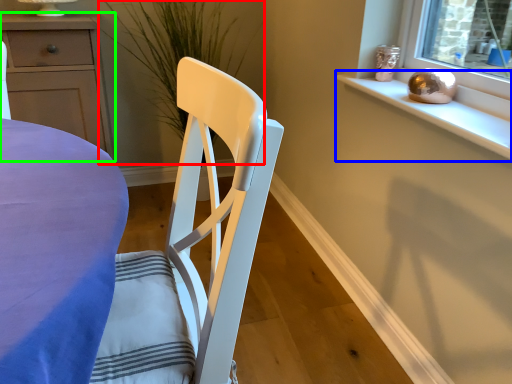
Question: Considering the real-world distances, which object is closest to plant (highlighted by a red box)? window sill (highlighted by a blue box) or cabinetry (highlighted by a green box).

Choices:
 (A) window sill
 (B) cabinetry

Answer: (B)